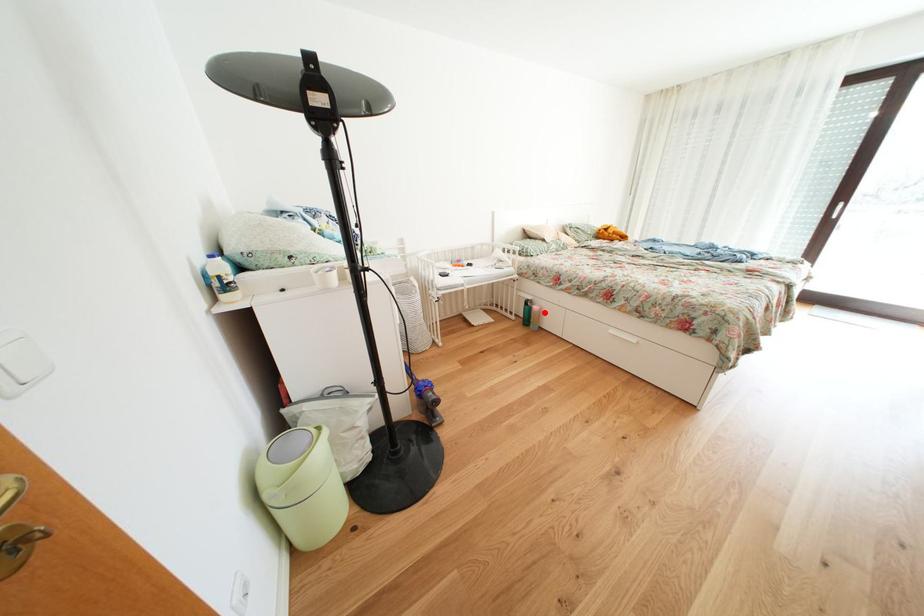
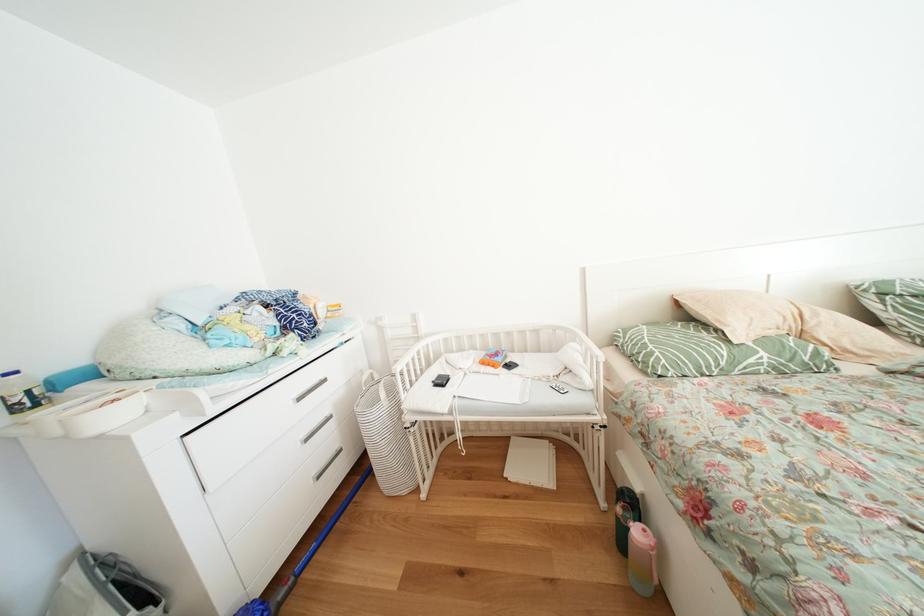
In the second image, find the point that corresponds to the highlighted location in the first image.

(648, 538)